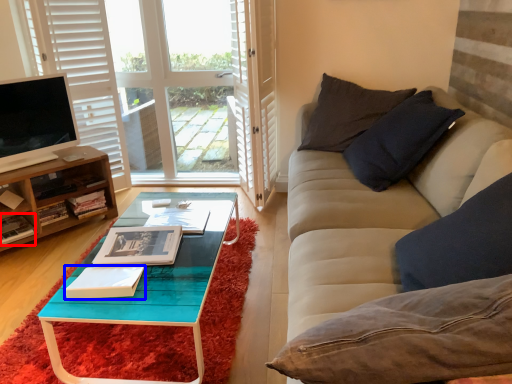
Question: Which point is further to the camera, book (highlighted by a red box) or book (highlighted by a blue box)?

Choices:
 (A) book
 (B) book

Answer: (A)